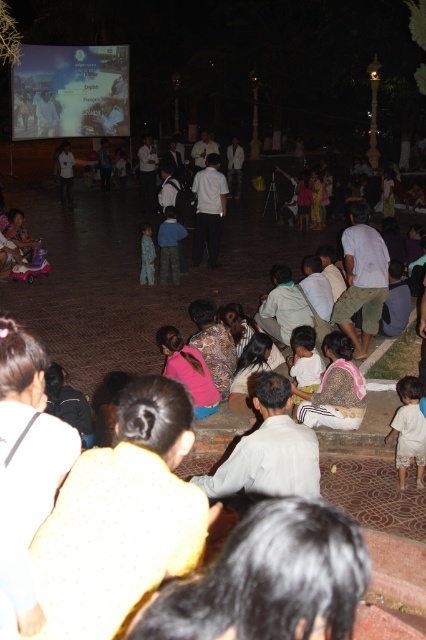
Is white cotton shirt at center bigger than blue denim pants at center?

No, white cotton shirt at center is not bigger than blue denim pants at center.

From the picture: Is white cotton shirt at center to the right of blue denim pants at center from the viewer's perspective?

Yes, white cotton shirt at center is to the right of blue denim pants at center.

Does point (299, 400) lie in front of point (167, 205)?

Yes, point (299, 400) is closer to viewer.

This screenshot has height=640, width=426. Find the location of `white cotton shirt at center`. white cotton shirt at center is located at coordinates (305, 358).

Does white cotton shirt at center have a smaller size compared to light blue pajamas at center?

Yes, white cotton shirt at center is smaller than light blue pajamas at center.

Image resolution: width=426 pixels, height=640 pixels. Describe the element at coordinates (305, 358) in the screenshot. I see `white cotton shirt at center` at that location.

I want to click on white cotton shirt at center, so click(x=305, y=358).

Between white cotton shirt at lower right and blue denim pants at center, which one has more height?

blue denim pants at center

Between point (417, 397) and point (169, 221), which one is positioned behind?

Point (169, 221)

At what (x,y) coordinates should I click in order to perform the action: click on white cotton shirt at lower right. Please return your answer as a coordinate pair (x, y). Looking at the image, I should click on (408, 429).